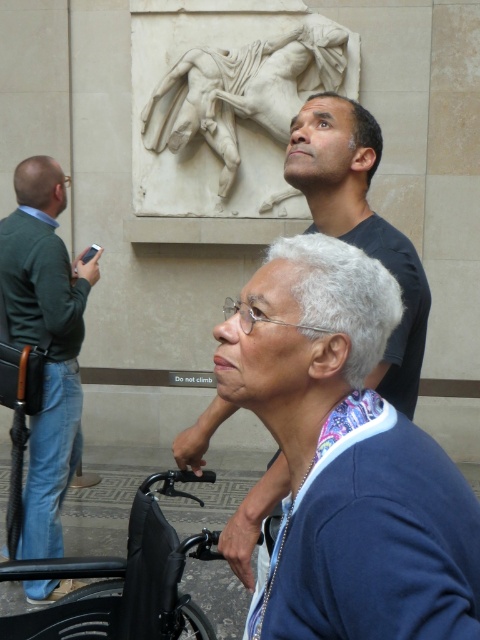
You are an art student observing the scene in the museum. You notice the green sweater at left and the white marble relief at upper center. Which object is larger in size?

The white marble relief at upper center is larger than the green sweater at left.

You are standing in the museum and want to take a photo of the white marble relief at upper center without any obstruction. Is the green sweater at left blocking your view?

The green sweater at left is taller than the white marble relief at upper center, so it would block the view of the relief.

You are a tour guide in the museum and want to move from the black plastic wheelchair at lower left to the white marble relief at upper center. Which direction should you move to reach the relief?

You should move to the right to reach the white marble relief at upper center from the black plastic wheelchair at lower left since the wheelchair is to the left of the relief.